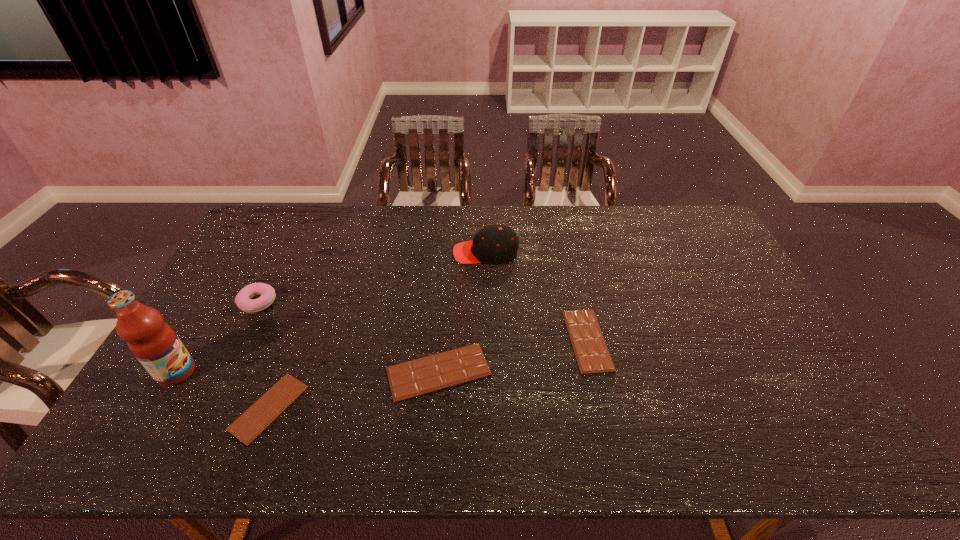
The width and height of the screenshot is (960, 540). What are the coordinates of `fruit juice that is at the near edge` in the screenshot? It's located at (153, 342).

Identify the location of fruit juice present at the left edge. (153, 342).

Where is `pastry at the left edge`? This screenshot has width=960, height=540. pastry at the left edge is located at coordinates point(243,300).

Where is `object that is at the near left corner`? The image size is (960, 540). object that is at the near left corner is located at coordinates (153, 342).

Identify the location of free region at the far edge. (558, 225).

Find the location of `blank area at the near edge`. blank area at the near edge is located at coordinates (507, 395).

Where is `vacant space at the left edge of the desktop`? Image resolution: width=960 pixels, height=540 pixels. vacant space at the left edge of the desktop is located at coordinates (209, 324).

Identify the location of vacant space at the right edge. point(734,297).

Locate an element on the screen. Image resolution: width=960 pixels, height=540 pixels. vacant region between the second chocolate bar from right to left and the leftmost chocolate bar is located at coordinates (354, 389).

The width and height of the screenshot is (960, 540). What are the coordinates of `empty space that is in between the shortest object and the fifth shortest object` in the screenshot? It's located at (377, 330).